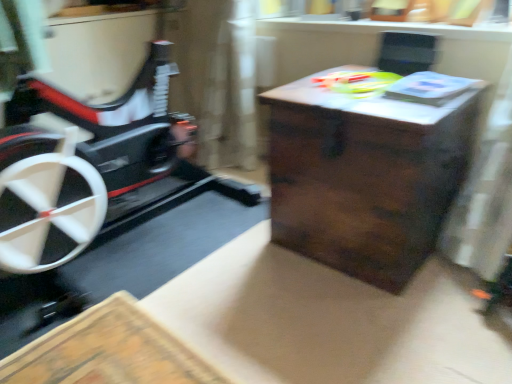
Identify the location of vacant space in front of dark wood table at center. The width and height of the screenshot is (512, 384). (377, 319).